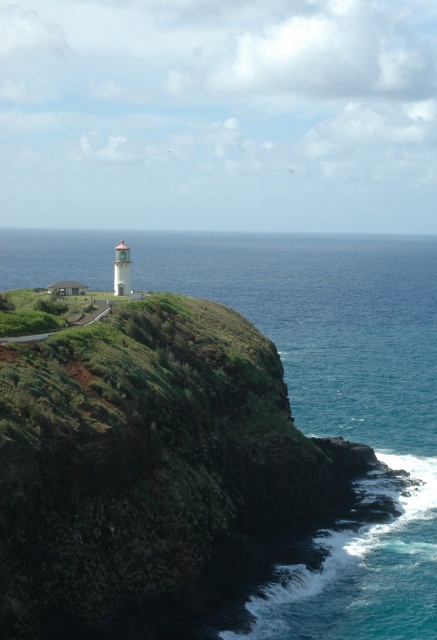
Question: Does blue water at lower right appear on the right side of green grassy shoreline at lower left?

Choices:
 (A) no
 (B) yes

Answer: (B)

Question: Which object appears closest to the camera in this image?

Choices:
 (A) green grassy shoreline at lower left
 (B) blue water at lower right

Answer: (B)

Question: Can you confirm if blue water at lower right is positioned to the left of green grassy shoreline at lower left?

Choices:
 (A) no
 (B) yes

Answer: (A)

Question: Which point appears closest to the camera in this image?

Choices:
 (A) (420, 433)
 (B) (17, 339)

Answer: (B)

Question: Is blue water at lower right further to the viewer compared to green grassy shoreline at lower left?

Choices:
 (A) no
 (B) yes

Answer: (A)